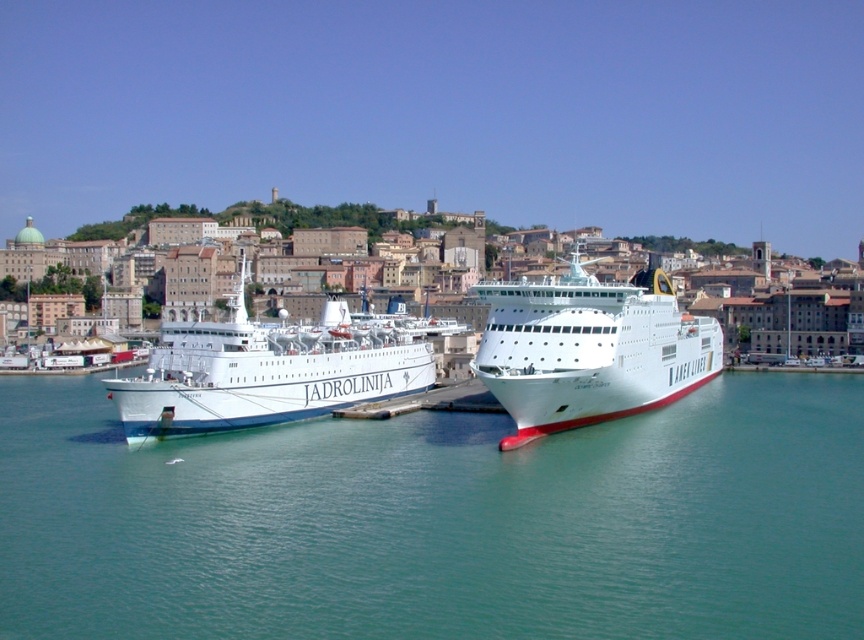
Question: In this image, where is white glossy ship at center located relative to white glossy ship at left?

Choices:
 (A) below
 (B) above

Answer: (B)

Question: Is white glossy ship at center positioned in front of white glossy ship at left?

Choices:
 (A) yes
 (B) no

Answer: (A)

Question: Which point appears farthest from the camera in this image?

Choices:
 (A) (516, 410)
 (B) (144, 516)

Answer: (A)

Question: Can you confirm if white glossy ship at center is wider than white glossy ship at left?

Choices:
 (A) no
 (B) yes

Answer: (A)

Question: Which of the following is the farthest from the observer?

Choices:
 (A) (240, 417)
 (B) (648, 508)

Answer: (A)

Question: Estimate the real-world distances between objects in this image. Which object is closer to the white glossy ship at center?

Choices:
 (A) clear blue water at center
 (B) white glossy ship at left

Answer: (A)